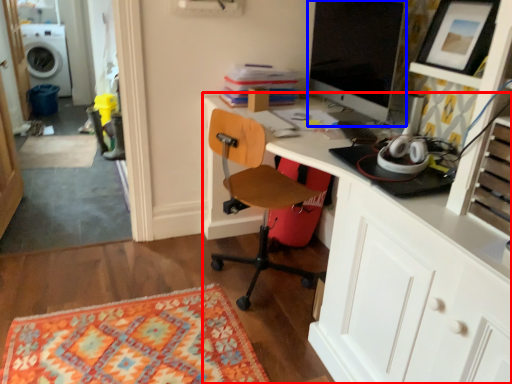
Question: Among these objects, which one is farthest to the camera, desk (highlighted by a red box) or computer monitor (highlighted by a blue box)?

Choices:
 (A) desk
 (B) computer monitor

Answer: (B)